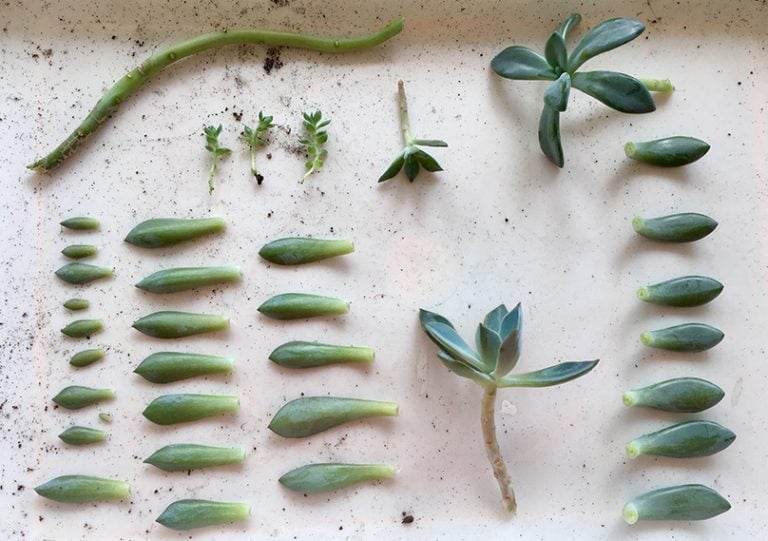
Find the location of a particular element. The image size is (768, 541). medium sized plant is located at coordinates (411, 137).